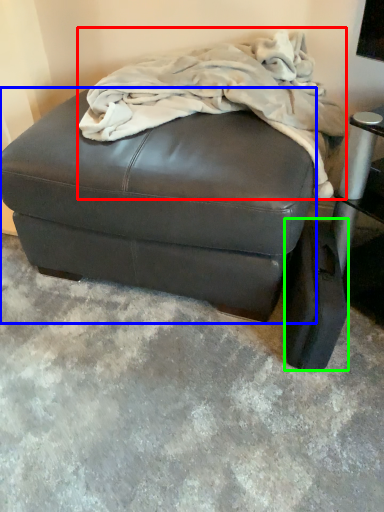
Question: Which object is positioned closest to blanket (highlighted by a red box)? Select from furniture (highlighted by a blue box) and pad (highlighted by a green box).

Choices:
 (A) furniture
 (B) pad

Answer: (A)